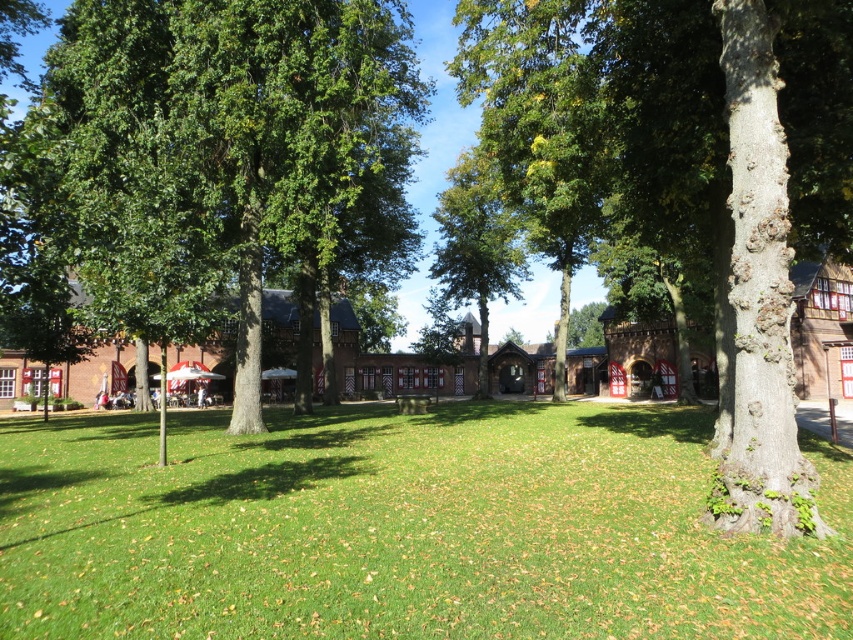
The height and width of the screenshot is (640, 853). What do you see at coordinates (399, 529) in the screenshot?
I see `green grass at center` at bounding box center [399, 529].

Which is below, green grass at center or green leafy tree at center?

Positioned lower is green grass at center.

The width and height of the screenshot is (853, 640). What do you see at coordinates (399, 529) in the screenshot?
I see `green grass at center` at bounding box center [399, 529].

Where is `green grass at center`? green grass at center is located at coordinates (399, 529).

In the scene shown: How far apart are green grass at center and green leafy tree at left?

green grass at center and green leafy tree at left are 7.79 meters apart.

Based on the photo, which is above, green grass at center or green leafy tree at left?

Positioned higher is green leafy tree at left.

Does point (195, 545) come closer to viewer compared to point (212, 36)?

Yes, it is.

The height and width of the screenshot is (640, 853). Find the location of `green grass at center`. green grass at center is located at coordinates (399, 529).

Between green leafy tree at left and green leafy tree at center, which one is positioned higher?

green leafy tree at left is above.

The height and width of the screenshot is (640, 853). What do you see at coordinates (218, 150) in the screenshot?
I see `green leafy tree at left` at bounding box center [218, 150].

Identify the location of green leafy tree at left. (218, 150).